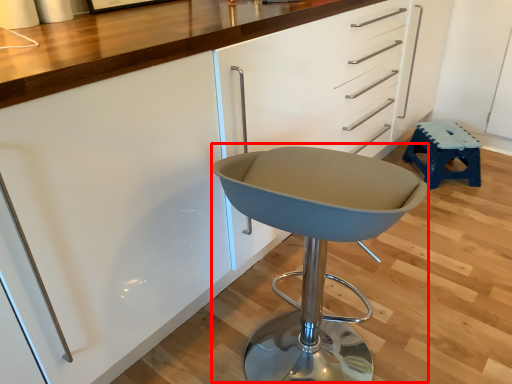
Question: From the image's perspective, considering the relative positions of swivel chair (annotated by the red box) and stool in the image provided, where is swivel chair (annotated by the red box) located with respect to the staircase?

Choices:
 (A) above
 (B) below

Answer: (B)